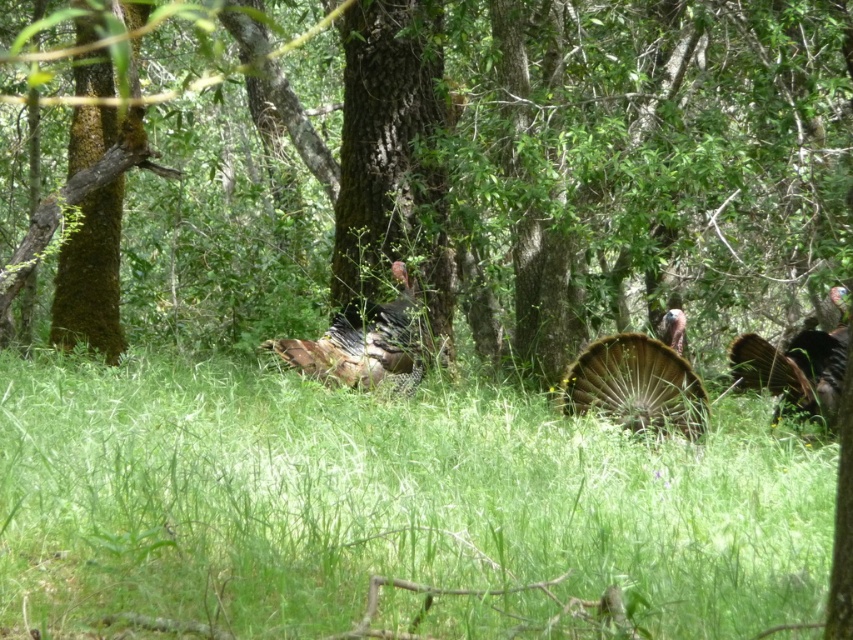
You are a hiker trying to cross the forest. You see the green grassy at center and the green mossy tree at center. Which one is shorter?

The green grassy at center is shorter than the green mossy tree at center.

Based on the photo, you are a hiker trying to navigate through the forest. You see the green grassy at center and the green mossy tree at center. Which direction should you go to reach the tree from the grassy area?

To reach the green mossy tree at center from the green grassy at center, you should go to the right since the green grassy at center is located to the left of the green mossy tree at center.